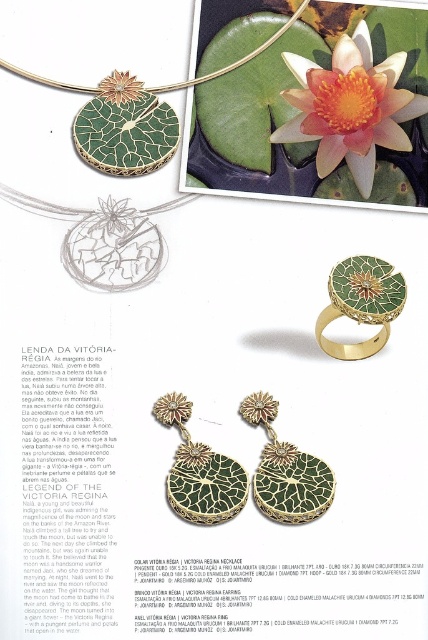
You are a jewelry designer who wants to wear both the green mosaic earrings at center and the green mosaic ring at center for a presentation. Considering their placement and size, which piece would require more space on your face or hand?

The green mosaic earrings at center might be wider than the green mosaic ring at center, so they would require more space on your face compared to the ring on your hand.

You are a jeweler examining the necklace in the image. You need to determine the position of two points on the necklace. Which point is closer to the camera, point at position (341, 131) or point at position (389, 316)?

Point at position (341, 131) is further to the camera than point at position (389, 316). Therefore, the point at position (389, 316) is closer to the camera.

You are an artist trying to draw the Victoria Regina jewelry collection. You need to ensure that the two points in the design, point (377, 132) and point (290, 452), are correctly positioned in terms of depth. Which point should appear closer to the viewer in your drawing?

Point (290, 452) should appear closer to the viewer because it is closer to the camera than point (377, 132).